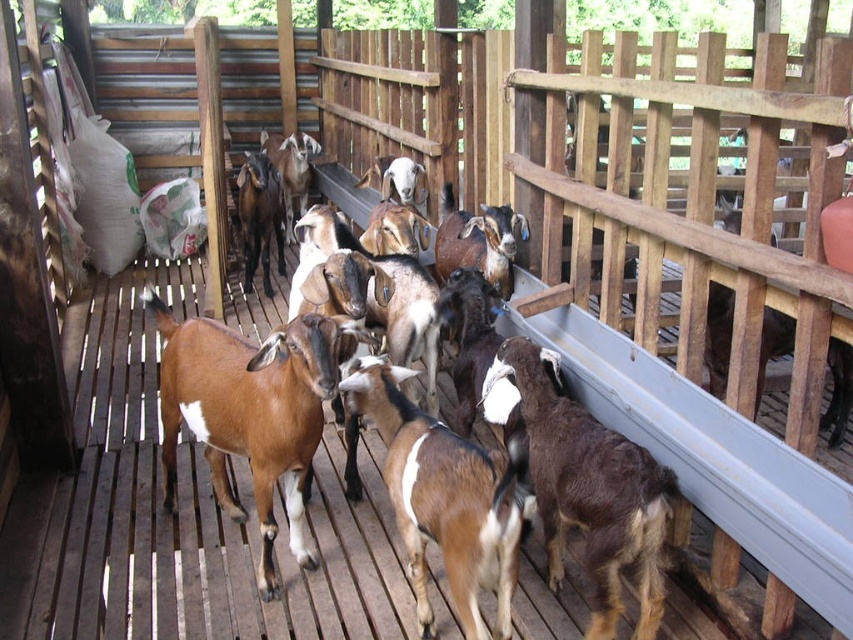
Can you confirm if brown matte goat at center is thinner than brown fuzzy goat at center?

No, brown matte goat at center is not thinner than brown fuzzy goat at center.

Between brown matte goat at center and brown fuzzy goat at center, which one is positioned higher?

brown matte goat at center

Which is behind, point (247, 452) or point (611, 490)?

Positioned behind is point (247, 452).

This screenshot has width=853, height=640. I want to click on brown matte goat at center, so click(248, 412).

Does brown matte goat at center appear on the left side of brown matte/goat at center?

Yes, brown matte goat at center is to the left of brown matte/goat at center.

Can you confirm if brown matte goat at center is bigger than brown matte/goat at center?

Indeed, brown matte goat at center has a larger size compared to brown matte/goat at center.

Does point (296, 547) come behind point (491, 502)?

That is True.

Find the location of a particular element. brown matte goat at center is located at coordinates (248, 412).

Is point (566, 445) closer to camera compared to point (462, 500)?

No, (566, 445) is behind (462, 500).

Which of these two, brown fuzzy goat at center or brown matte/goat at center, stands taller?

brown fuzzy goat at center

Image resolution: width=853 pixels, height=640 pixels. What do you see at coordinates (590, 490) in the screenshot?
I see `brown fuzzy goat at center` at bounding box center [590, 490].

This screenshot has height=640, width=853. What are the coordinates of `brown fuzzy goat at center` in the screenshot? It's located at (590, 490).